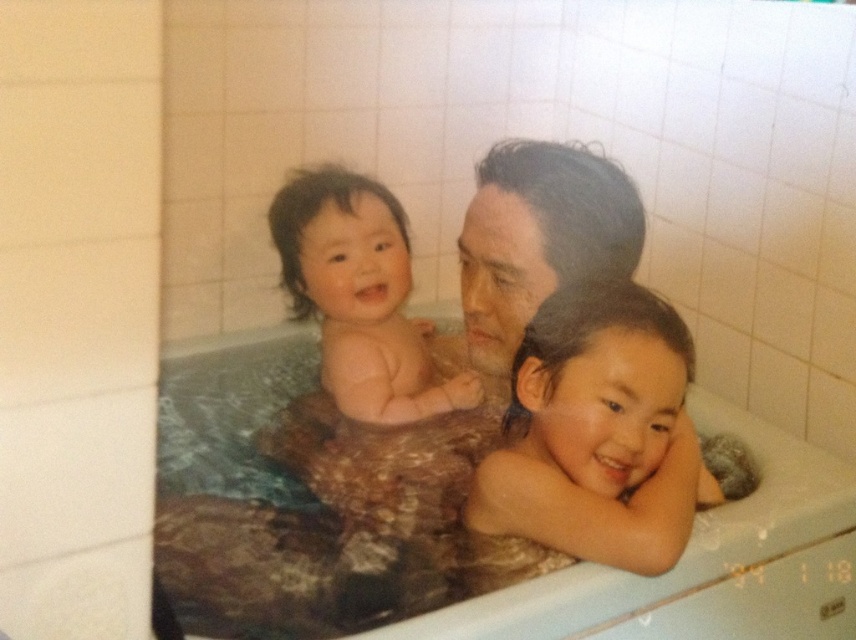
Question: Can you confirm if brown textured fabric at center is bigger than smooth skin baby at center?

Choices:
 (A) no
 (B) yes

Answer: (B)

Question: Which object appears closest to the camera in this image?

Choices:
 (A) smooth skin child at center
 (B) smooth skin baby at center

Answer: (A)

Question: Which is farther from the brown textured fabric at center?

Choices:
 (A) smooth skin baby at center
 (B) smooth skin child at center

Answer: (A)

Question: Is smooth skin child at center to the right of smooth skin baby at center from the viewer's perspective?

Choices:
 (A) yes
 (B) no

Answer: (A)

Question: Where is smooth skin child at center located in relation to brown textured fabric at center in the image?

Choices:
 (A) below
 (B) above

Answer: (B)

Question: Which object is positioned closest to the smooth skin child at center?

Choices:
 (A) brown textured fabric at center
 (B) smooth skin baby at center

Answer: (A)